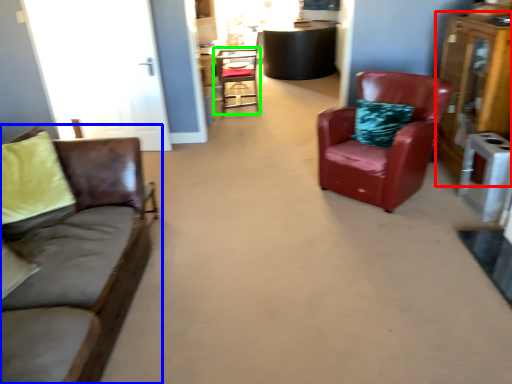
Question: Estimate the real-world distances between objects in this image. Which object is closer to dresser (highlighted by a red box), studio couch (highlighted by a blue box) or chair (highlighted by a green box)?

Choices:
 (A) studio couch
 (B) chair

Answer: (A)